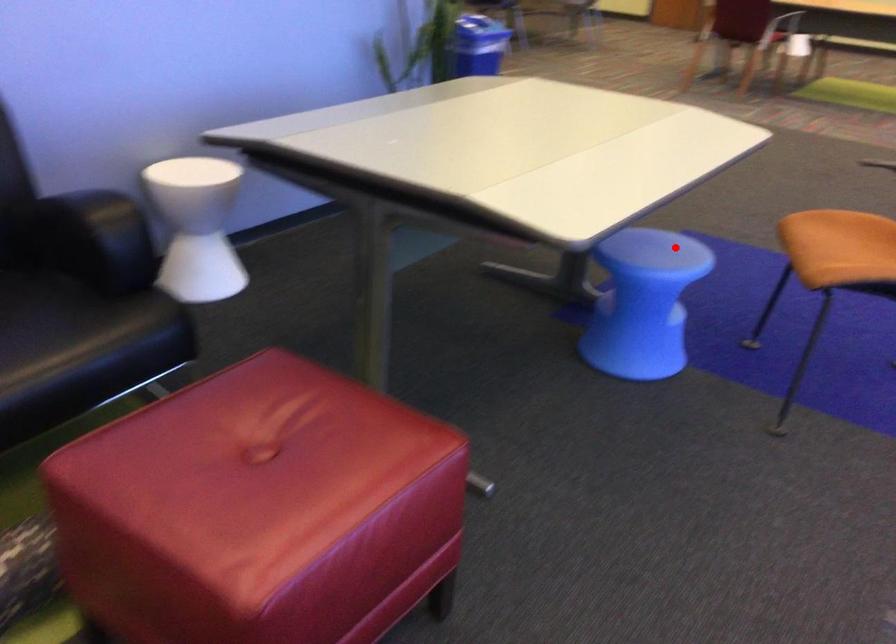
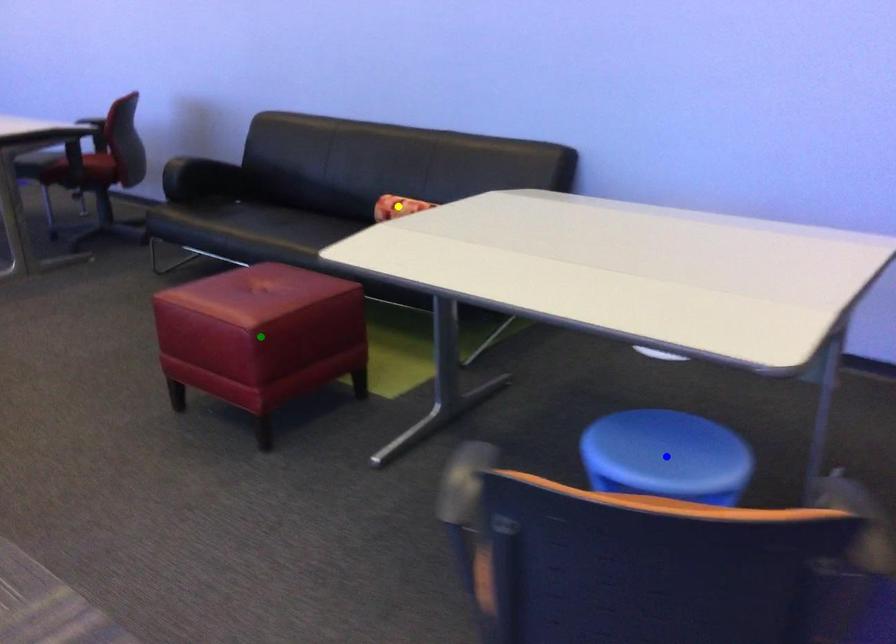
Question: I am providing you with two images of the same scene from different viewpoints. A red point is marked on the first image. You are given multiple points on the second image. Which mark in image 2 goes with the point in image 1?

Choices:
 (A) yellow point
 (B) green point
 (C) blue point

Answer: (C)